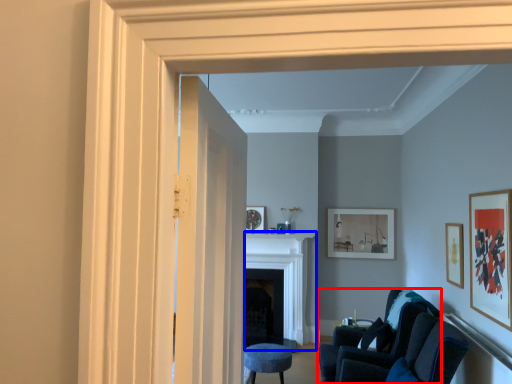
Question: Which object appears farthest to the camera in this image, chair (highlighted by a red box) or fireplace (highlighted by a blue box)?

Choices:
 (A) chair
 (B) fireplace

Answer: (B)